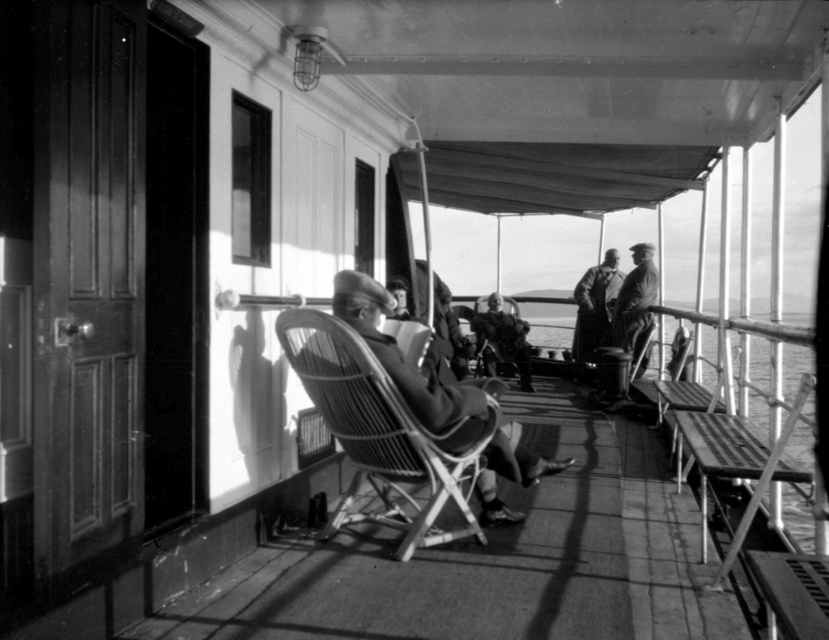
You are standing on the deck of the ship and see the woven wood chair at center and the smooth leather hat at center. Which object is positioned to the left?

The woven wood chair at center is to the left of the smooth leather hat at center.

You are a passenger on this ship and you see both the smooth leather hat at center and the coarse wool coat at center. Which one is located to the left?

The smooth leather hat at center is positioned on the left side of coarse wool coat at center, so the smooth leather hat at center is located to the left.

You are a passenger on this ship and want to sit down. You see a woven wood chair at center and a smooth leather hat at center. Which object can you sit on?

The woven wood chair at center can be sat on, as it is a chair designed for seating. The smooth leather hat at center is a hat and not meant for sitting.